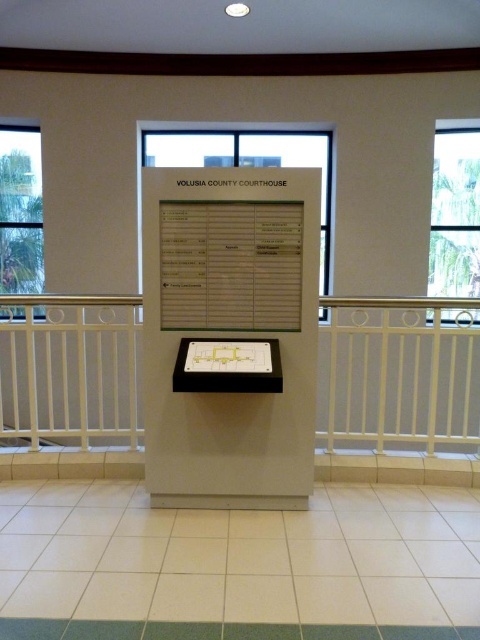
Is white paperboard at center positioned before transparent glass window at center?

Yes, it is in front of transparent glass window at center.

Who is more distant from viewer, (289, 276) or (282, 154)?

The point (282, 154) is more distant.

At what (x,y) coordinates should I click in order to perform the action: click on white paperboard at center. Please return your answer as a coordinate pair (x, y). Looking at the image, I should click on (230, 266).

Is white metal balustrade at center in front of clear glass window at upper right?

Yes, white metal balustrade at center is closer to the viewer.

In order to click on white metal balustrade at center in this screenshot , I will do `click(397, 374)`.

Is point (457, 400) in front of point (440, 220)?

Yes, it is in front of point (440, 220).

At what (x,y) coordinates should I click in order to perform the action: click on white metal balustrade at center. Please return your answer as a coordinate pair (x, y). Looking at the image, I should click on coord(397,374).

Between white glossy pillar at center and white metal balustrade at center, which one is positioned lower?

white metal balustrade at center is below.

Between white glossy pillar at center and white metal balustrade at center, which one appears on the right side from the viewer's perspective?

white metal balustrade at center

Who is more distant from viewer, [208,484] or [323,424]?

Point [323,424]

In order to click on white glossy pillar at center in this screenshot , I will do `click(229, 333)`.